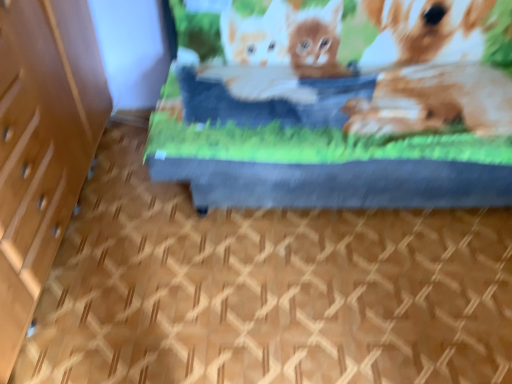
Question: Could blue fabric bed at center be considered to be inside wooden file cabinet at left?

Choices:
 (A) yes
 (B) no

Answer: (B)

Question: Is wooden file cabinet at left smaller than blue fabric bed at center?

Choices:
 (A) yes
 (B) no

Answer: (A)

Question: Considering the relative sizes of wooden file cabinet at left and blue fabric bed at center in the image provided, is wooden file cabinet at left taller than blue fabric bed at center?

Choices:
 (A) no
 (B) yes

Answer: (B)

Question: Is wooden file cabinet at left at the left side of blue fabric bed at center?

Choices:
 (A) no
 (B) yes

Answer: (B)

Question: Is wooden file cabinet at left further to camera compared to blue fabric bed at center?

Choices:
 (A) no
 (B) yes

Answer: (A)

Question: Is blue fabric bed at center at the back of wooden file cabinet at left?

Choices:
 (A) no
 (B) yes

Answer: (A)

Question: Is blue fabric bed at center to the left of wooden file cabinet at left from the viewer's perspective?

Choices:
 (A) yes
 (B) no

Answer: (B)

Question: Does blue fabric bed at center have a lesser width compared to wooden file cabinet at left?

Choices:
 (A) no
 (B) yes

Answer: (A)

Question: Is blue fabric bed at center not near wooden file cabinet at left?

Choices:
 (A) no
 (B) yes

Answer: (A)

Question: Does blue fabric bed at center turn towards wooden file cabinet at left?

Choices:
 (A) no
 (B) yes

Answer: (A)

Question: Are blue fabric bed at center and wooden file cabinet at left making contact?

Choices:
 (A) yes
 (B) no

Answer: (B)

Question: Is blue fabric bed at center to the right of wooden file cabinet at left from the viewer's perspective?

Choices:
 (A) yes
 (B) no

Answer: (A)

Question: Relative to wooden file cabinet at left, is blue fabric bed at center in front or behind?

Choices:
 (A) front
 (B) behind

Answer: (B)